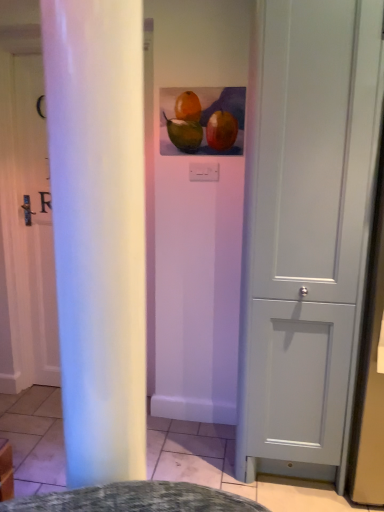
You are a GUI agent. You are given a task and a screenshot of the screen. Output one action in this format:
    pyautogui.click(x=<x>, y=<y>)
    Task: Click on the matte gray cabinet at right
    Image resolution: width=384 pixels, height=512 pixels.
    Given the screenshot: What is the action you would take?
    pyautogui.click(x=305, y=230)

This screenshot has width=384, height=512. What do you see at coordinates (305, 230) in the screenshot?
I see `matte gray cabinet at right` at bounding box center [305, 230].

Locate an element on the screen. matte gray cabinet at right is located at coordinates (305, 230).